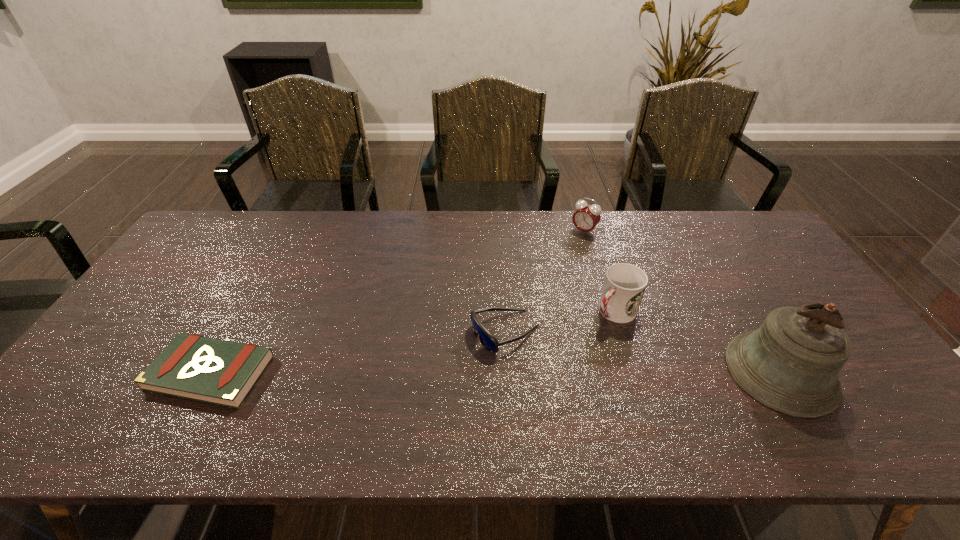
Locate an element on the screen. book is located at coordinates (220, 372).

I want to click on the leftmost object, so click(220, 372).

You are a GUI agent. You are given a task and a screenshot of the screen. Output one action in this format:
    pyautogui.click(x=<x>, y=<y>)
    Task: Click on the tallest object
    
    Given the screenshot: What is the action you would take?
    pyautogui.click(x=790, y=364)

Image resolution: width=960 pixels, height=540 pixels. Identify the location of the rightmost object. (790, 364).

Find the location of a particular element. This screenshot has height=540, width=960. cup is located at coordinates (624, 285).

The width and height of the screenshot is (960, 540). Find the location of `the farthest object`. the farthest object is located at coordinates (587, 216).

Where is `sunglasses`? The image size is (960, 540). sunglasses is located at coordinates (488, 341).

Find the location of a particular element. The image size is (960, 540). the second shortest object is located at coordinates (488, 341).

The image size is (960, 540). I want to click on vacant space situated on the right of the shortest object, so click(x=341, y=373).

The height and width of the screenshot is (540, 960). I want to click on vacant space located on the left of the rightmost object, so click(565, 372).